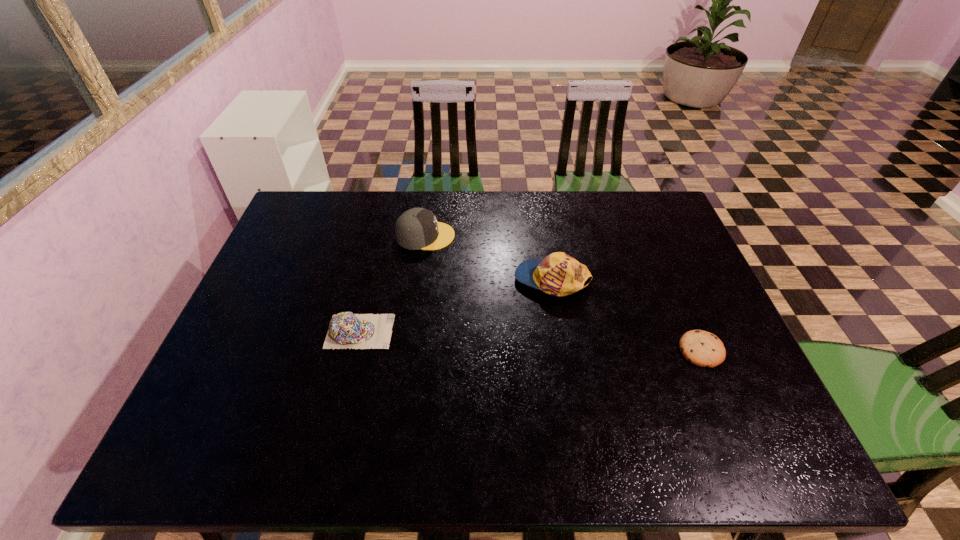
Image resolution: width=960 pixels, height=540 pixels. In order to click on free point that satisfies the following two spatial constraints: 1. on the back side of the shortest object; 2. on the bill of the second object from right to left in this screenshot , I will do `click(671, 280)`.